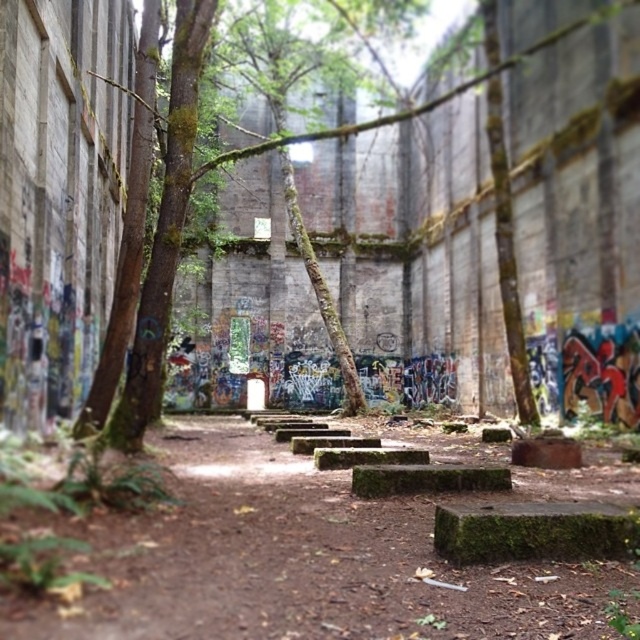
Which is behind, point (544, 486) or point (132, 262)?

Positioned behind is point (132, 262).

Which of these two, mossy concrete steps at center or green mossy tree at center, stands taller?

With more height is green mossy tree at center.

Which is in front, point (401, 573) or point (179, 81)?

Positioned in front is point (401, 573).

Where is `mossy concrete steps at center`? The image size is (640, 640). mossy concrete steps at center is located at coordinates (312, 556).